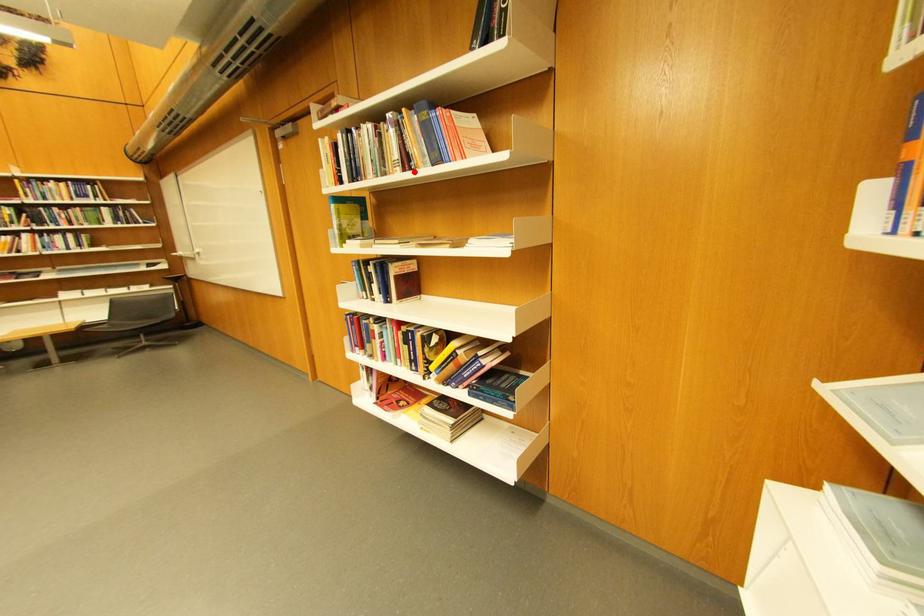
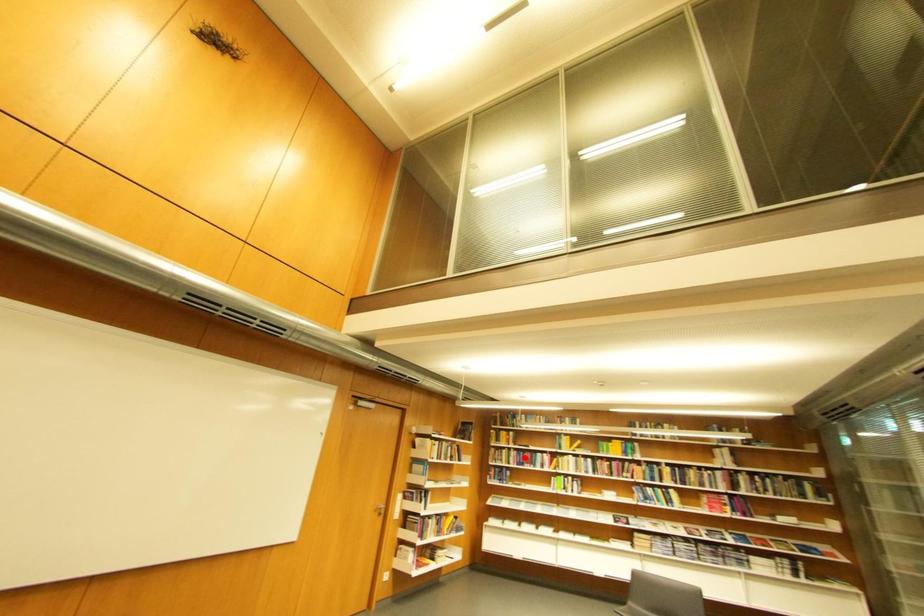
I am providing you with two images of the same scene from different viewpoints. A red point is marked on the first image and another point is marked on the second image. Is the red point in image1 aligned with the point shown in image2?

No